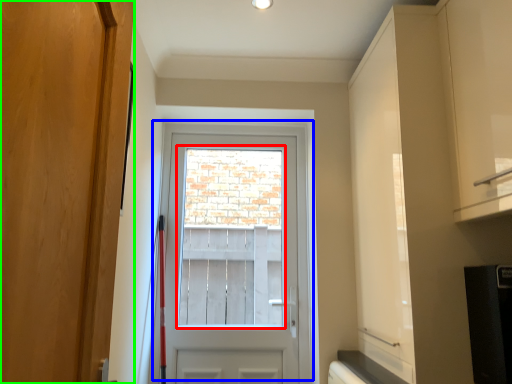
Question: Estimate the real-world distances between objects in this image. Which object is farther from window screen (highlighted by a red box), door (highlighted by a blue box) or door (highlighted by a green box)?

Choices:
 (A) door
 (B) door

Answer: (B)